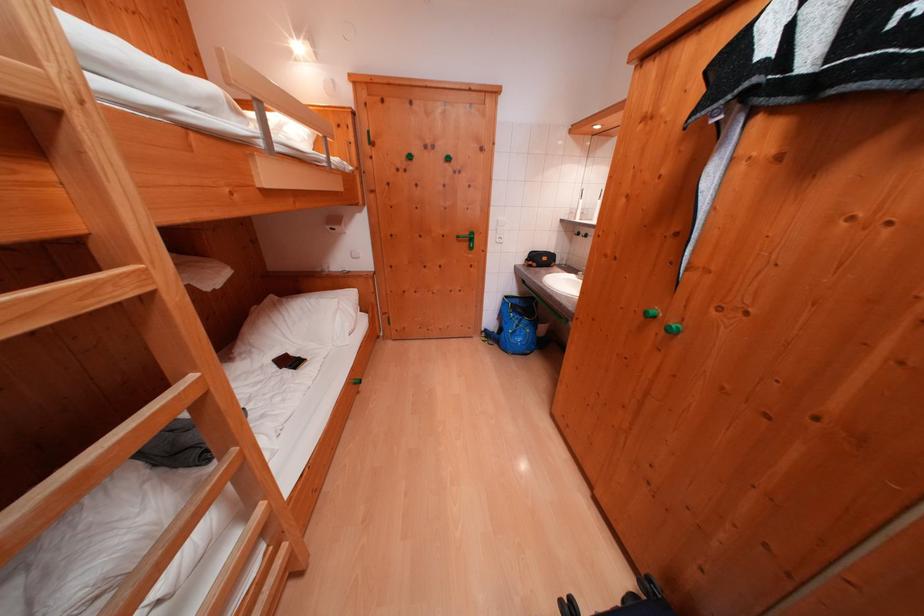
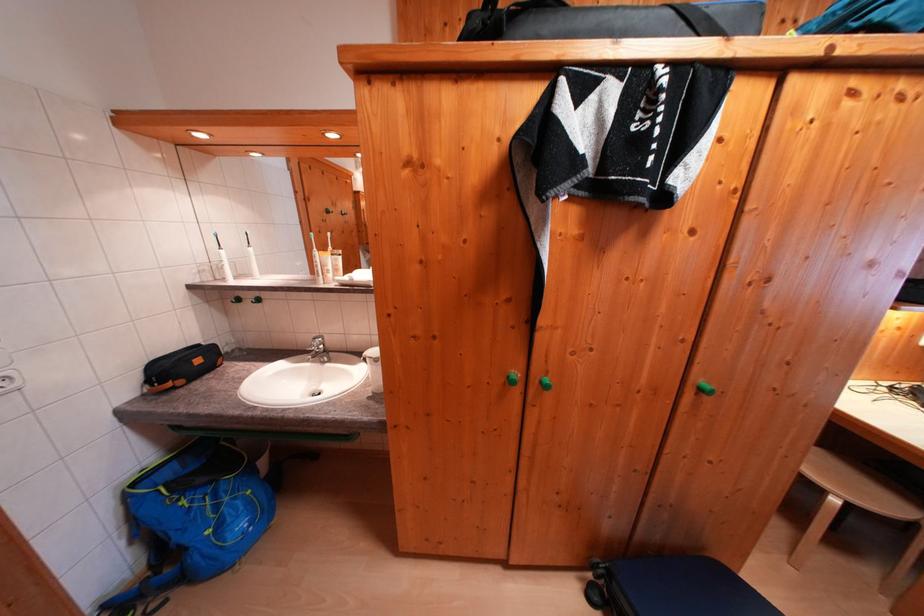
Question: The first image is from the beginning of the video and the second image is from the end. How did the camera likely rotate when shooting the video?

Choices:
 (A) Left
 (B) Right
 (C) Up
 (D) Down

Answer: (B)